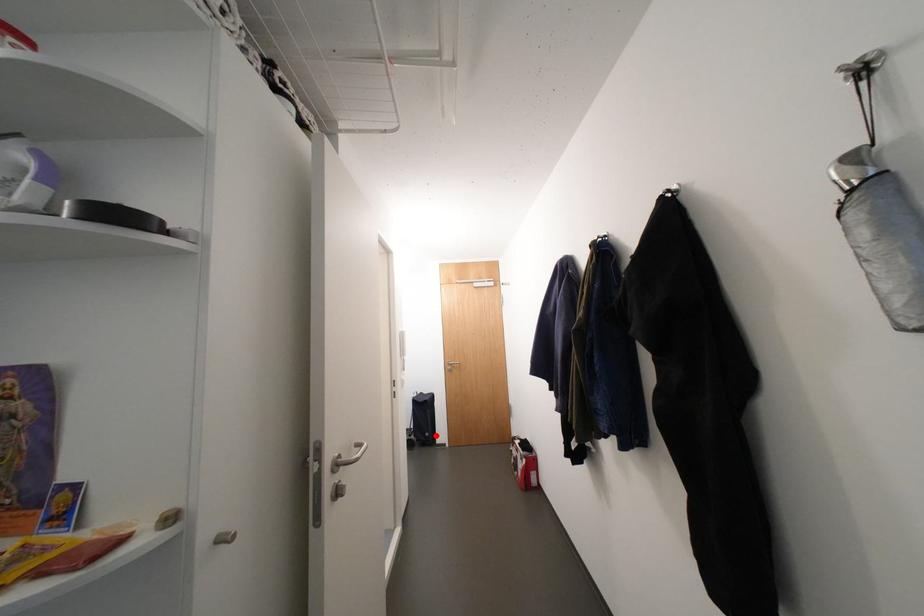
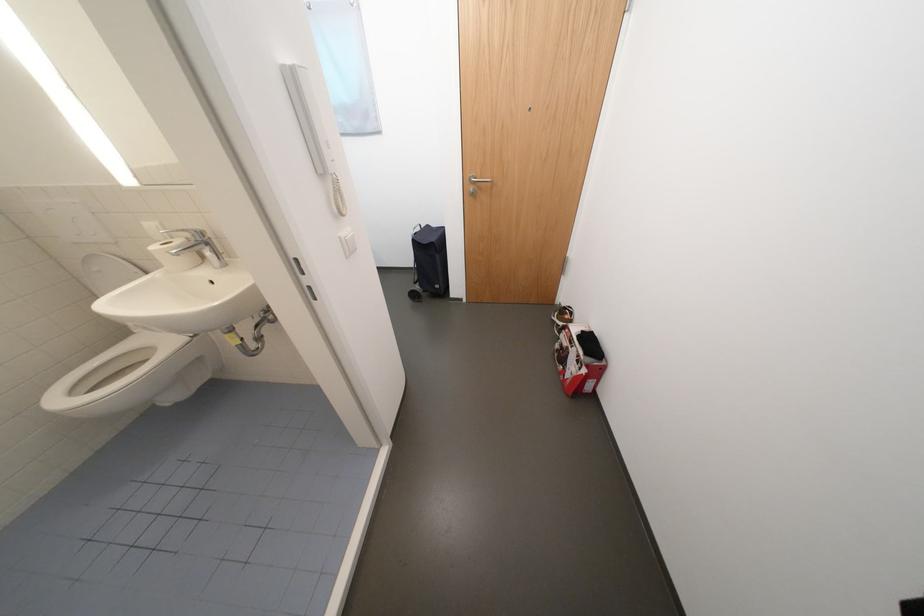
Question: I am providing you with two images of the same scene from different viewpoints. A red point is shown in image1. For the corresponding object point in image2, is it positioned nearer or farther from the camera?

Choices:
 (A) Nearer
 (B) Farther

Answer: (A)